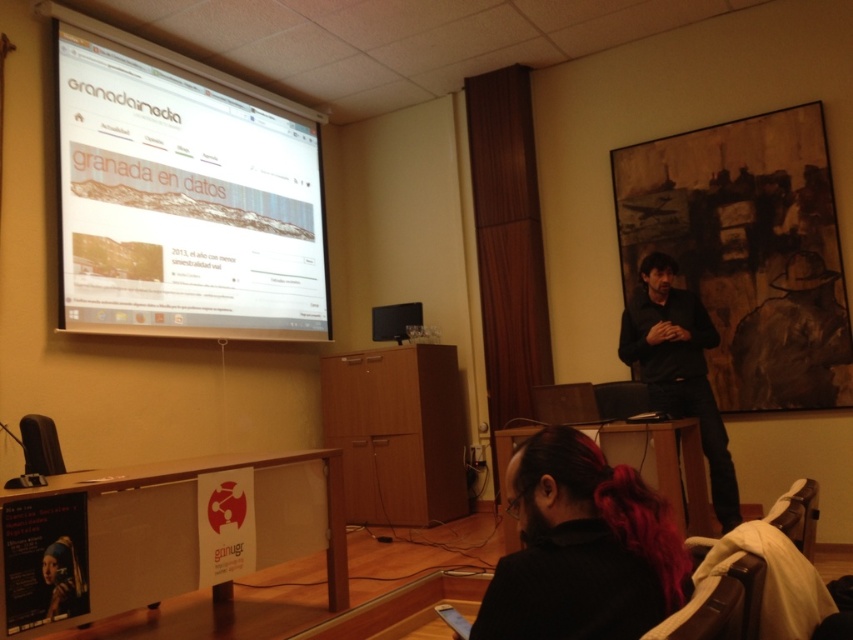
Question: Does dark hair at lower center have a greater width compared to black matte shirt at center?

Choices:
 (A) no
 (B) yes

Answer: (A)

Question: Which point is closer to the camera taking this photo?

Choices:
 (A) (672, 364)
 (B) (683, 563)
 (C) (270, 116)

Answer: (B)

Question: Which point is farther to the camera?

Choices:
 (A) (561, 536)
 (B) (61, 259)
 (C) (718, 417)

Answer: (C)

Question: Is dark hair at lower center smaller than black matte shirt at center?

Choices:
 (A) no
 (B) yes

Answer: (B)

Question: Which object is the farthest from the dark hair at lower center?

Choices:
 (A) white glossy projector screen at upper left
 (B) black matte shirt at center

Answer: (A)

Question: Does white glossy projector screen at upper left appear on the right side of black matte shirt at center?

Choices:
 (A) no
 (B) yes

Answer: (A)